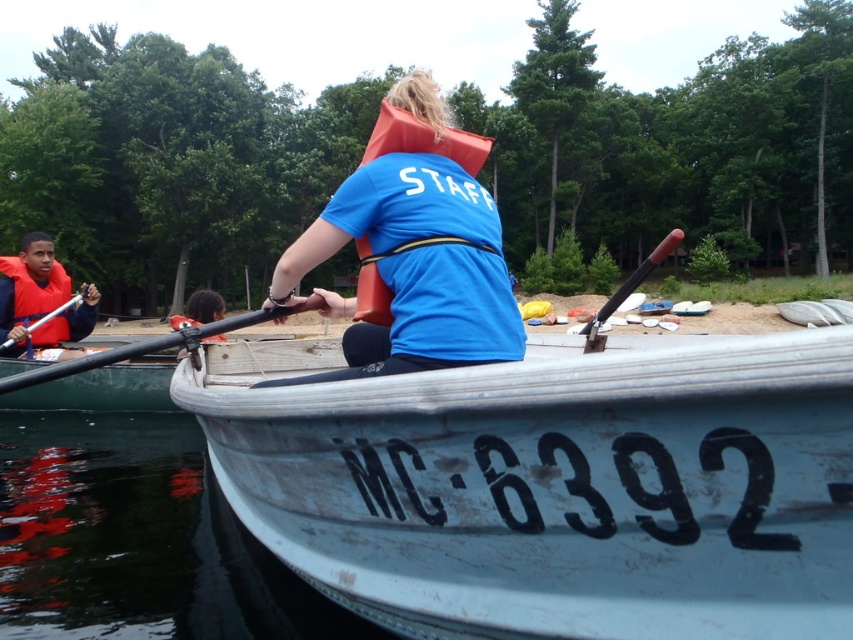
Question: Does matte orange life vest at center have a larger size compared to matte orange life jacket at center?

Choices:
 (A) no
 (B) yes

Answer: (B)

Question: Which point is farther to the camera?

Choices:
 (A) (624, 289)
 (B) (236, 324)

Answer: (A)

Question: Does orange foam life jacket at center lie behind matte orange life jacket at center?

Choices:
 (A) no
 (B) yes

Answer: (A)

Question: Does orange foam life jacket at center appear on the left side of matte orange life jacket at center?

Choices:
 (A) yes
 (B) no

Answer: (B)

Question: Which point is farther from the camera taking this photo?

Choices:
 (A) (55, 260)
 (B) (463, 328)
 (C) (196, 321)

Answer: (A)

Question: Which object is farther from the camera taking this photo?

Choices:
 (A) white weathered wood boat at center
 (B) matte orange life jacket at left

Answer: (B)